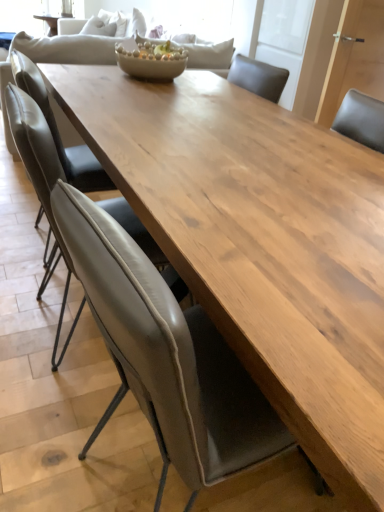
Question: Considering the relative sizes of leather at center, which is the 1th chair from front to back, and matte gray chair at center, the second chair viewed from the back, in the image provided, is leather at center, which is the 1th chair from front to back, smaller than matte gray chair at center, the second chair viewed from the back,?

Choices:
 (A) yes
 (B) no

Answer: (B)

Question: From the image's perspective, is leather at center, which is counted as the third chair, starting from the back, located beneath matte gray chair at center, the 2th chair in the front-to-back sequence?

Choices:
 (A) no
 (B) yes

Answer: (B)

Question: Can you confirm if leather at center, which is counted as the third chair, starting from the back, is wider than matte gray chair at center, the second chair viewed from the back?

Choices:
 (A) yes
 (B) no

Answer: (A)

Question: From a real-world perspective, is leather at center, which is counted as the third chair, starting from the back, under matte gray chair at center, the second chair viewed from the back?

Choices:
 (A) no
 (B) yes

Answer: (B)

Question: Does leather at center, which is counted as the third chair, starting from the back, lie behind matte gray chair at center, the 2th chair in the front-to-back sequence?

Choices:
 (A) yes
 (B) no

Answer: (B)

Question: In terms of height, does leather at center, which is counted as the third chair, starting from the back, look taller or shorter compared to matte gray chair at center, the 2th chair in the front-to-back sequence?

Choices:
 (A) tall
 (B) short

Answer: (A)

Question: From the image's perspective, is leather at center, which is counted as the third chair, starting from the back, located above or below matte gray chair at center, the 2th chair in the front-to-back sequence?

Choices:
 (A) above
 (B) below

Answer: (B)

Question: Considering the positions of leather at center, which is the 1th chair from front to back, and matte gray chair at center, the second chair viewed from the back, in the image, is leather at center, which is the 1th chair from front to back, wider or thinner than matte gray chair at center, the second chair viewed from the back,?

Choices:
 (A) wide
 (B) thin

Answer: (A)

Question: From a real-world perspective, relative to matte gray chair at center, the 2th chair in the front-to-back sequence, is leather at center, which is the 1th chair from front to back, vertically above or below?

Choices:
 (A) above
 (B) below

Answer: (B)

Question: From the image's perspective, is leather at left, the third chair positioned from the front, positioned above or below matte ceramic bowl at center?

Choices:
 (A) above
 (B) below

Answer: (B)

Question: Do you think leather at left, arranged as the first chair when viewed from the back, is within matte ceramic bowl at center, or outside of it?

Choices:
 (A) outside
 (B) inside

Answer: (A)

Question: In terms of height, does leather at left, the third chair positioned from the front, look taller or shorter compared to matte ceramic bowl at center?

Choices:
 (A) tall
 (B) short

Answer: (A)

Question: Would you say leather at left, the third chair positioned from the front, is to the left or to the right of matte ceramic bowl at center in the picture?

Choices:
 (A) left
 (B) right

Answer: (A)

Question: Is leather at center, which is counted as the third chair, starting from the back, bigger or smaller than leather at left, the third chair positioned from the front?

Choices:
 (A) small
 (B) big

Answer: (B)

Question: Do you think leather at center, which is counted as the third chair, starting from the back, is within leather at left, arranged as the first chair when viewed from the back, or outside of it?

Choices:
 (A) inside
 (B) outside

Answer: (B)